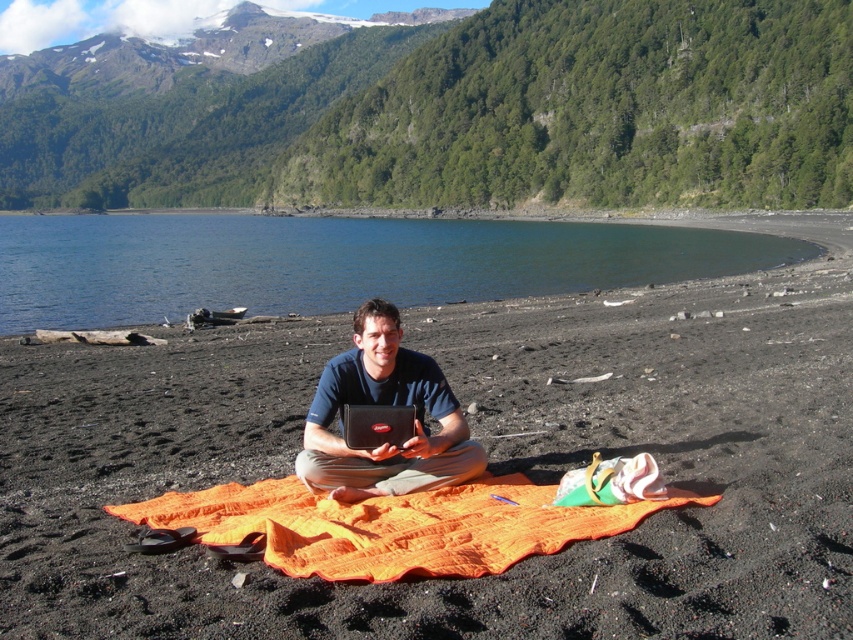
You are standing in the serene outdoor scene by the lake. You see an orange woven blanket at center and a dark blue fabric at center. Which one is positioned to the right side?

The orange woven blanket at center is to the right of the dark blue fabric at center.

You are standing at the edge of the lake and want to retrieve the orange woven blanket at center without getting your shoes wet. The nearest dry path is 7.52 meters away from the blanket. Can you reach the blanket without stepping into the water?

The nearest dry path is 7.52 meters away from the orange woven blanket at center. Since you can walk along the dry path to the blanket, you can reach it without getting your shoes wet.